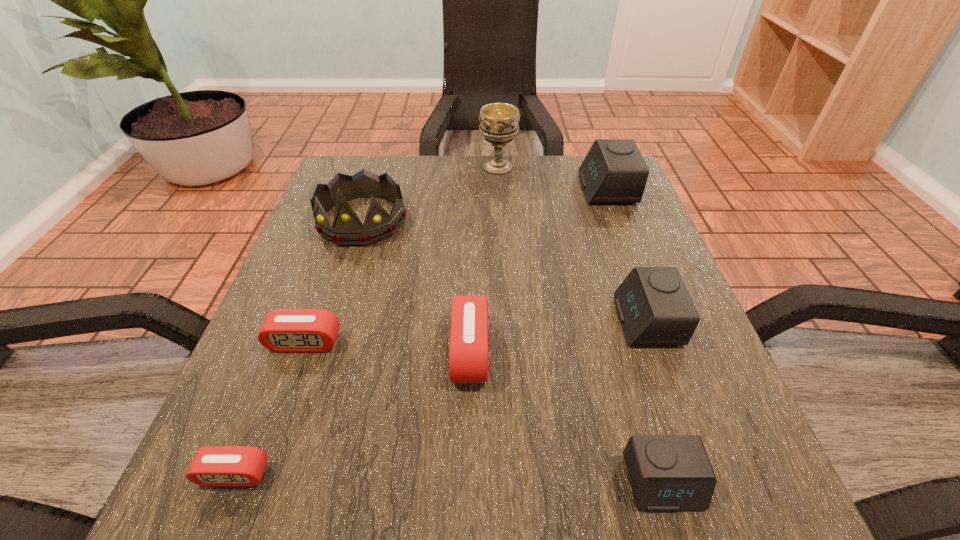
Locate an element on the screen. The image size is (960, 540). vacant space located 0.080m on the front-facing side of the second biggest pink alarm clock is located at coordinates (285, 397).

I want to click on free location located on the front-facing side of the nearest pink alarm clock, so click(212, 531).

At what (x,y) coordinates should I click in order to perform the action: click on chalice that is at the far edge. Please return your answer as a coordinate pair (x, y). Image resolution: width=960 pixels, height=540 pixels. Looking at the image, I should click on (498, 122).

You are a GUI agent. You are given a task and a screenshot of the screen. Output one action in this format:
    pyautogui.click(x=<x>, y=<y>)
    Task: Click on the tiara present at the far edge
    
    Given the screenshot: What is the action you would take?
    pyautogui.click(x=347, y=230)

In order to click on alarm clock located in the far edge section of the desktop in this screenshot , I will do `click(614, 171)`.

I want to click on tiara present at the left edge, so click(347, 230).

Find the location of a particular element. The image size is (960, 540). object located in the far left corner section of the desktop is located at coordinates (347, 230).

Identify the location of object located at the near left corner. (211, 466).

Find the location of a particular element. The image size is (960, 540). object that is at the far right corner is located at coordinates (614, 171).

You are a GUI agent. You are given a task and a screenshot of the screen. Output one action in this format:
    pyautogui.click(x=<x>, y=<y>)
    Task: Click on the object located in the near right corner section of the desktop
    The height and width of the screenshot is (540, 960).
    Given the screenshot: What is the action you would take?
    pyautogui.click(x=668, y=473)